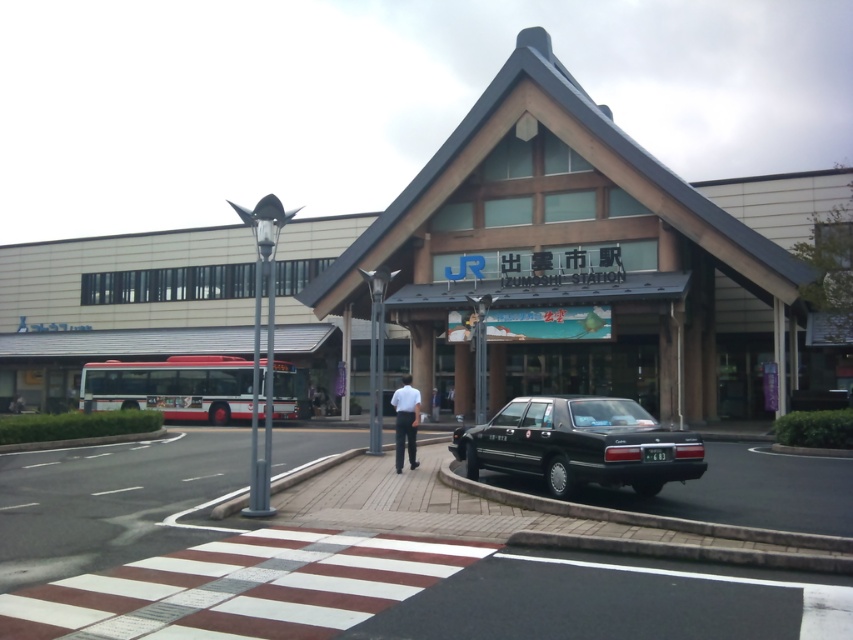
Question: Observing the image, what is the correct spatial positioning of black glossy sedan at lower right in reference to white fabric shirt at center?

Choices:
 (A) right
 (B) left

Answer: (A)

Question: Observing the image, what is the correct spatial positioning of brown wooden mall at center in reference to black glossy sedan at lower right?

Choices:
 (A) below
 (B) above

Answer: (B)

Question: Which object is farther from the camera taking this photo?

Choices:
 (A) black glossy sedan at lower right
 (B) brown wooden mall at center
 (C) white fabric shirt at center
 (D) white shirt at center

Answer: (C)

Question: Is black glossy sedan at lower right further to camera compared to white fabric shirt at center?

Choices:
 (A) no
 (B) yes

Answer: (A)

Question: Which point appears farthest from the camera in this image?

Choices:
 (A) (674, 465)
 (B) (126, 260)
 (C) (415, 422)
 (D) (433, 403)

Answer: (B)

Question: Which of the following is the closest to the observer?

Choices:
 (A) (433, 419)
 (B) (402, 404)

Answer: (B)